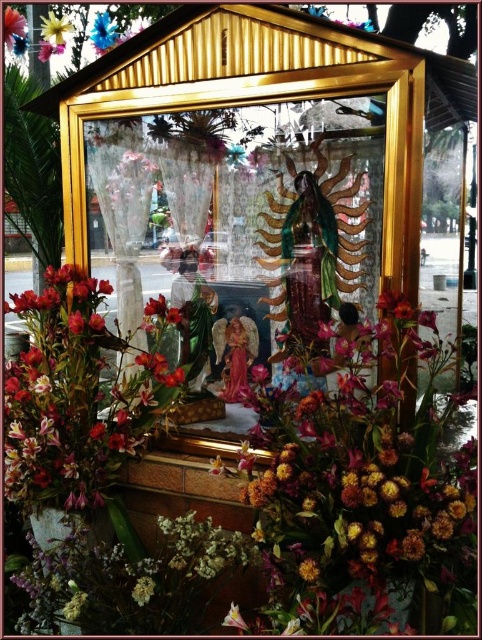
You are standing in front of the shrine and want to place a small offering. There are two points marked on the shrine where you can place it. The first point is at coordinate point (52, 486) and the second is at point (59, 48). Which point is closer to you?

Point (52, 486) is closer to the camera than point (59, 48), so the first point is closer to you.

You are standing in front of the shrine and want to place a new floral bouquet exactly at the center of the shrine. According to the current arrangement, is the existing floral bouquet at center already occupying that spot?

The floral bouquet at center is located at point (240, 470), which indicates it is already placed at the center coordinates of the shrine. Therefore, the existing floral bouquet at center is occupying the desired central spot.

You are standing in front of the shrine and want to place a small offering. The offering needs to be placed closer to the viewer than the yellow fabric flower at upper left. Can you place it on the floral bouquet at center?

Yes, the floral bouquet at center is closer to the viewer than the yellow fabric flower at upper left, so placing the offering there would satisfy the requirement.